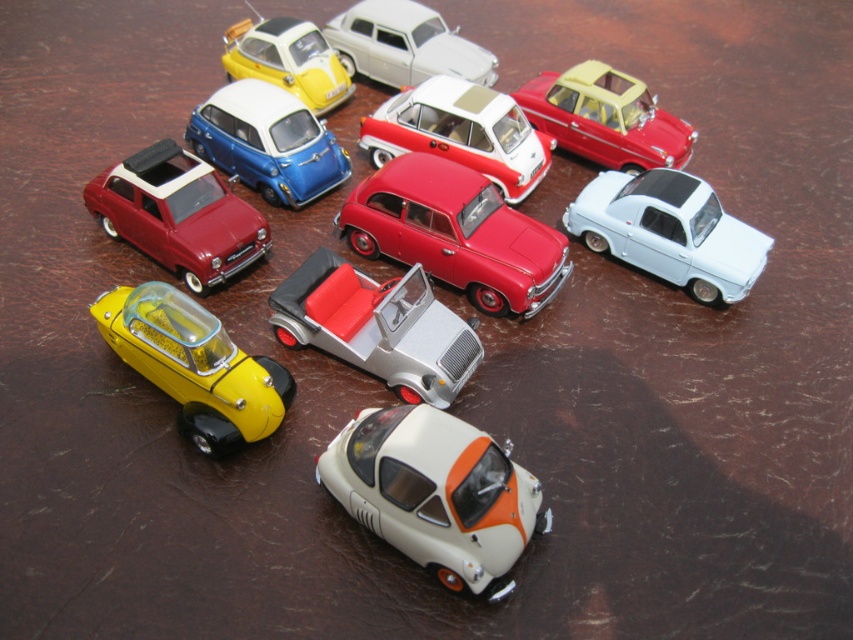
Does shiny yellow car at bottom left have a smaller size compared to matte yellow car at upper left?

Correct, shiny yellow car at bottom left occupies less space than matte yellow car at upper left.

Can you confirm if shiny yellow car at bottom left is shorter than matte yellow car at upper left?

Yes.

Between point (161, 369) and point (259, 64), which one is positioned behind?

The point (259, 64) is more distant.

Where is `shiny yellow car at bottom left`? This screenshot has height=640, width=853. shiny yellow car at bottom left is located at coordinates (194, 364).

Who is more forward, (463, 372) or (231, 397)?

Point (231, 397)

Is the position of silver metallic convertible at center more distant than that of shiny yellow car at bottom left?

Yes, silver metallic convertible at center is further from the viewer.

Find the location of `silver metallic convertible at center`. silver metallic convertible at center is located at coordinates (376, 326).

Locate an element on the screen. matte red car at upper left is located at coordinates (178, 214).

Is matte red car at upper left bigger than matte blue car at upper center?

Actually, matte red car at upper left might be smaller than matte blue car at upper center.

Which is in front, point (93, 205) or point (289, 186)?

Point (93, 205)

Where is `matte red car at upper left`? Image resolution: width=853 pixels, height=640 pixels. matte red car at upper left is located at coordinates (178, 214).